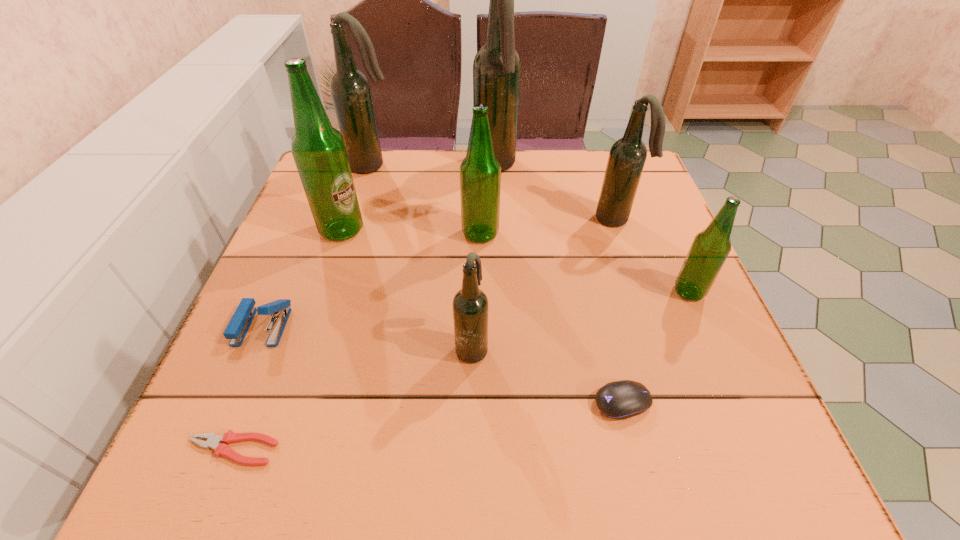
Image resolution: width=960 pixels, height=540 pixels. Find the location of `free space in the image that satisfies the following two spatial constraints: 1. on the label of the leftmost green beer bottle; 2. on the front side of the shortest object`. free space in the image that satisfies the following two spatial constraints: 1. on the label of the leftmost green beer bottle; 2. on the front side of the shortest object is located at coordinates (268, 449).

Locate an element on the screen. Image resolution: width=960 pixels, height=540 pixels. vacant space that satisfies the following two spatial constraints: 1. on the front side of the biggest dark beer bottle; 2. on the left side of the second nearest object is located at coordinates (505, 402).

Where is `blank space that satisfies the following two spatial constraints: 1. on the front side of the tallest beer bottle; 2. on the left side of the leftmost dark beer bottle`? This screenshot has height=540, width=960. blank space that satisfies the following two spatial constraints: 1. on the front side of the tallest beer bottle; 2. on the left side of the leftmost dark beer bottle is located at coordinates (372, 166).

Where is `free space that satisfies the following two spatial constraints: 1. on the front side of the leftmost dark beer bottle; 2. on the right side of the third biggest dark beer bottle`? The width and height of the screenshot is (960, 540). free space that satisfies the following two spatial constraints: 1. on the front side of the leftmost dark beer bottle; 2. on the right side of the third biggest dark beer bottle is located at coordinates (357, 219).